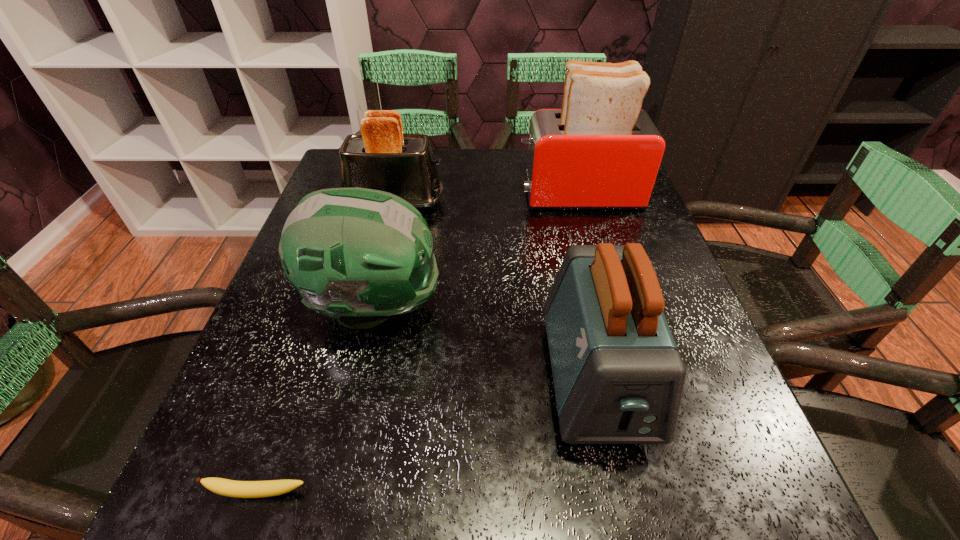
You are a GUI agent. You are given a task and a screenshot of the screen. Output one action in this format:
    pyautogui.click(x=<x>, y=<y>)
    Task: Click on the free spot located 0.240m on the side of the leftmost toaster with the control lever
    This screenshot has height=540, width=960.
    Given the screenshot: What is the action you would take?
    pyautogui.click(x=542, y=202)

You are a GUI agent. You are given a task and a screenshot of the screen. Output one action in this format:
    pyautogui.click(x=<x>, y=<y>)
    Task: Click on the object that is at the near edge
    The image size is (960, 540).
    Given the screenshot: What is the action you would take?
    pyautogui.click(x=241, y=489)

Identify the location of football helmet at the left edge. (357, 255).

You are a GUI agent. You are given a task and a screenshot of the screen. Output one action in this format:
    pyautogui.click(x=<x>, y=<y>)
    Task: Click on the toaster at the left edge
    This screenshot has height=540, width=960.
    Given the screenshot: What is the action you would take?
    pyautogui.click(x=382, y=157)

Where is `banana positioned at the left edge`? This screenshot has width=960, height=540. banana positioned at the left edge is located at coordinates (241, 489).

The height and width of the screenshot is (540, 960). What are the coordinates of `object situated at the far left corner` in the screenshot? It's located at (382, 157).

Where is `object that is positioned at the near left corner`? The height and width of the screenshot is (540, 960). object that is positioned at the near left corner is located at coordinates (241, 489).

Locate an element on the screen. This screenshot has width=960, height=540. object that is positioned at the far right corner is located at coordinates (601, 151).

This screenshot has width=960, height=540. What are the coordinates of `free spot at the far edge of the desktop` in the screenshot? It's located at (487, 153).

Find the location of `free space at the near edge`. free space at the near edge is located at coordinates (385, 512).